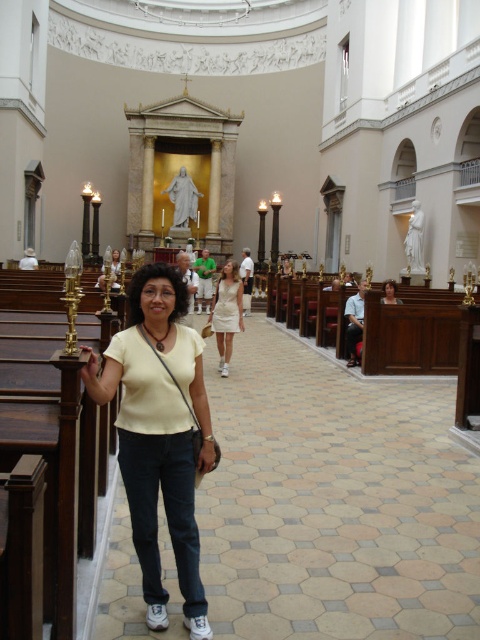
Question: Which of the following is the closest to the observer?

Choices:
 (A) (218, 323)
 (B) (388, 296)

Answer: (A)

Question: Which point appears closest to the camera in this image?

Choices:
 (A) (385, 284)
 (B) (219, 362)

Answer: (B)

Question: Which object is positioned farthest from the white cotton dress at center?

Choices:
 (A) matte white blouse at center
 (B) yellow cotton shirt at center

Answer: (B)

Question: Is white cotton dress at center thinner than matte white blouse at center?

Choices:
 (A) yes
 (B) no

Answer: (A)

Question: From the image, what is the correct spatial relationship of white cotton dress at center in relation to matte white blouse at center?

Choices:
 (A) above
 (B) below

Answer: (B)

Question: Can you confirm if yellow cotton shirt at center is positioned above white cotton dress at center?

Choices:
 (A) no
 (B) yes

Answer: (A)